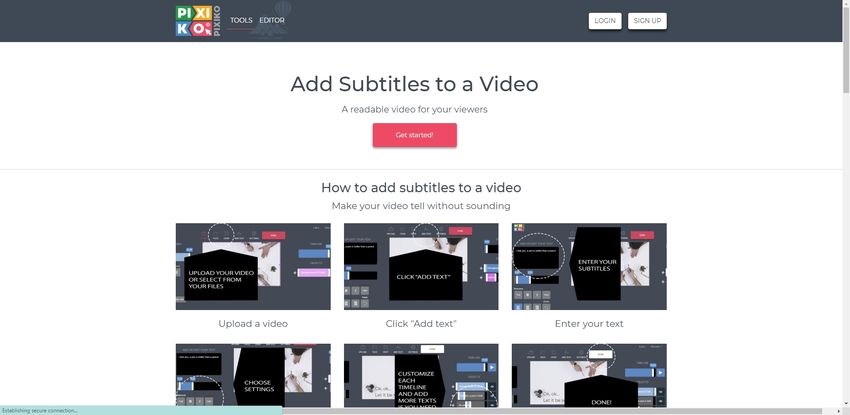
Locate an element on the screen. The image size is (850, 415). picture is located at coordinates (275, 260), (444, 257), (545, 251), (553, 373), (401, 375), (275, 376).